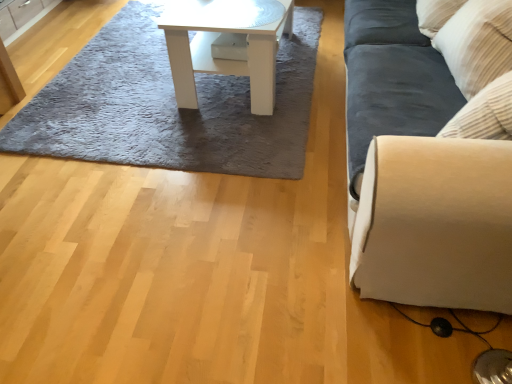
Question: Are gray shaggy rug at upper center and suede-like beige couch at right located far from each other?

Choices:
 (A) no
 (B) yes

Answer: (A)

Question: Is gray shaggy rug at upper center to the left of suede-like beige couch at right from the viewer's perspective?

Choices:
 (A) yes
 (B) no

Answer: (A)

Question: From the image's perspective, would you say gray shaggy rug at upper center is positioned over suede-like beige couch at right?

Choices:
 (A) no
 (B) yes

Answer: (B)

Question: Is gray shaggy rug at upper center looking in the opposite direction of suede-like beige couch at right?

Choices:
 (A) no
 (B) yes

Answer: (A)

Question: Does gray shaggy rug at upper center have a greater height compared to suede-like beige couch at right?

Choices:
 (A) no
 (B) yes

Answer: (A)

Question: From the image's perspective, is suede-like beige couch at right positioned above or below gray shaggy rug at upper center?

Choices:
 (A) above
 (B) below

Answer: (B)

Question: Looking at their shapes, would you say suede-like beige couch at right is wider or thinner than gray shaggy rug at upper center?

Choices:
 (A) wide
 (B) thin

Answer: (B)

Question: Visually, is suede-like beige couch at right positioned to the left or to the right of gray shaggy rug at upper center?

Choices:
 (A) right
 (B) left

Answer: (A)

Question: Which is correct: suede-like beige couch at right is inside gray shaggy rug at upper center, or outside of it?

Choices:
 (A) outside
 (B) inside

Answer: (A)

Question: In the image, is matte wood cabinet at upper left on the left side or the right side of white glossy table at center?

Choices:
 (A) left
 (B) right

Answer: (A)

Question: Do you think matte wood cabinet at upper left is within white glossy table at center, or outside of it?

Choices:
 (A) outside
 (B) inside

Answer: (A)

Question: From the image's perspective, relative to white glossy table at center, is matte wood cabinet at upper left above or below?

Choices:
 (A) below
 (B) above

Answer: (B)

Question: From a real-world perspective, is matte wood cabinet at upper left above or below white glossy table at center?

Choices:
 (A) below
 (B) above

Answer: (A)

Question: In the image, is gray shaggy rug at upper center positioned in front of or behind suede-like beige couch at right?

Choices:
 (A) front
 (B) behind

Answer: (B)

Question: Is point (58, 157) closer or farther from the camera than point (510, 170)?

Choices:
 (A) farther
 (B) closer

Answer: (A)